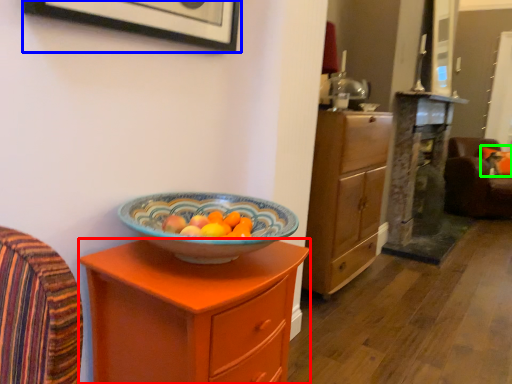
Question: Based on their relative distances, which object is farther from chest of drawers (highlighted by a red box)? Choose from picture frame (highlighted by a blue box) and pillow (highlighted by a green box).

Choices:
 (A) picture frame
 (B) pillow

Answer: (B)